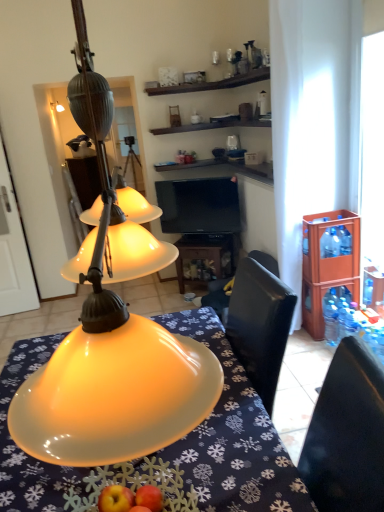
Describe the element at coordinates (233, 437) in the screenshot. The image size is (384, 512). I see `matte yellow lampshade at center` at that location.

What do you see at coordinates (112, 337) in the screenshot?
I see `matte yellow glass lampshade at center` at bounding box center [112, 337].

What do you see at coordinates (204, 258) in the screenshot?
I see `wooden table at center` at bounding box center [204, 258].

What is the approximate width of transparent plastic bottle at right, which appears as the third bottle when viewed from the top?

transparent plastic bottle at right, which appears as the third bottle when viewed from the top, is 3.31 inches in width.

What are the coordinates of `transparent plastic bottle at right, which is counted as the first bottle, starting from the bottom` in the screenshot? It's located at (331, 316).

Locate an element on the screen. black glossy tv at center is located at coordinates (199, 206).

Which object is positioned more to the left, matte yellow glass lampshade at center or matte yellow lampshade at center?

From the viewer's perspective, matte yellow glass lampshade at center appears more on the left side.

Is matte yellow glass lampshade at center in front of matte yellow lampshade at center?

Yes, the depth of matte yellow glass lampshade at center is less than that of matte yellow lampshade at center.

Are matte yellow glass lampshade at center and matte yellow lampshade at center making contact?

No, matte yellow glass lampshade at center is not beside matte yellow lampshade at center.

Based on the photo, can we say matte yellow glass lampshade at center lies outside matte yellow lampshade at center?

That's correct, matte yellow glass lampshade at center is outside of matte yellow lampshade at center.

Does point (190, 436) come behind point (208, 255)?

No, it is in front of (208, 255).

Is matte yellow lampshade at center smaller than wooden table at center?

Incorrect, matte yellow lampshade at center is not smaller in size than wooden table at center.

Does matte yellow lampshade at center have a greater width compared to wooden table at center?

Correct, the width of matte yellow lampshade at center exceeds that of wooden table at center.

Between matte yellow lampshade at center and wooden table at center, which one appears on the left side from the viewer's perspective?

matte yellow lampshade at center is more to the left.

From a real-world perspective, is blue plastic bottles at right, the 2th bottle when ordered from top to bottom, positioned under transparent plastic bottle at right, which appears as the third bottle when viewed from the top, based on gravity?

No, from a real-world perspective, blue plastic bottles at right, the 2th bottle when ordered from top to bottom, is not below transparent plastic bottle at right, which appears as the third bottle when viewed from the top.

Does blue plastic bottles at right, which is the second bottle from bottom to top, come in front of transparent plastic bottle at right, which is counted as the first bottle, starting from the bottom?

Yes, the depth of blue plastic bottles at right, which is the second bottle from bottom to top, is less than that of transparent plastic bottle at right, which is counted as the first bottle, starting from the bottom.

Does blue plastic bottles at right, which is the second bottle from bottom to top, turn towards transparent plastic bottle at right, which is counted as the first bottle, starting from the bottom?

No.

Is black glossy tv at center at the back of wooden table at center?

No.

Considering the points (183, 255) and (178, 215), which point is behind, point (183, 255) or point (178, 215)?

The point (178, 215) is more distant.

From a real-world perspective, which object rests below the other?

wooden table at center.

Locate an element on the screen. Image resolution: width=384 pixels, height=512 pixels. television above the wooden table at center (from a real-world perspective) is located at coordinates (199, 206).

Who is smaller, brown wooden cabinet at right or matte yellow glass lampshade at center?

Smaller between the two is brown wooden cabinet at right.

Considering the points (313, 220) and (103, 208), which point is in front, point (313, 220) or point (103, 208)?

Point (103, 208)

In the image, there is a matte yellow glass lampshade at center. Find the location of `bookshelf below it (from the image's perspective)`. bookshelf below it (from the image's perspective) is located at coordinates (328, 263).

Is matte yellow glass lampshade at center surrounded by brown wooden cabinet at right?

No, matte yellow glass lampshade at center is not inside brown wooden cabinet at right.

Who is shorter, transparent plastic bottle at right, which appears as the third bottle when viewed from the top, or black glossy tv at center?

transparent plastic bottle at right, which appears as the third bottle when viewed from the top.

This screenshot has width=384, height=512. I want to click on the 2nd bottle in front of the black glossy tv at center, starting your count from the anchor, so click(331, 316).

Considering the positions of objects transparent plastic bottle at right, which is counted as the first bottle, starting from the bottom, and black glossy tv at center in the image provided, who is more to the left, transparent plastic bottle at right, which is counted as the first bottle, starting from the bottom, or black glossy tv at center?

From the viewer's perspective, black glossy tv at center appears more on the left side.

Is the position of transparent plastic bottle at right, which appears as the third bottle when viewed from the top, less distant than that of brown wooden cabinet at right?

That is False.

From a real-world perspective, which object rests below the other?

transparent plastic bottle at right, which appears as the third bottle when viewed from the top.

Is brown wooden cabinet at right completely or partially inside transparent plastic bottle at right, which is counted as the first bottle, starting from the bottom?

No, brown wooden cabinet at right is not surrounded by transparent plastic bottle at right, which is counted as the first bottle, starting from the bottom.

Which object is wider, transparent plastic bottle at right, which appears as the third bottle when viewed from the top, or brown wooden cabinet at right?

brown wooden cabinet at right is wider.

The height and width of the screenshot is (512, 384). I want to click on lamp that is on the left side of matte yellow lampshade at center, so click(x=112, y=337).

This screenshot has height=512, width=384. What are the coordinates of `table below the matte yellow lampshade at center (from a real-world perspective)` in the screenshot? It's located at (204, 258).

Considering their positions, is matte yellow lampshade at center positioned further to black glossy tv at center than blue plastic bottles at right, which is the second bottle from bottom to top?

The object further to black glossy tv at center is matte yellow lampshade at center.

Considering their positions, is blue plastic bottles at right, which is the second bottle from bottom to top, positioned further to matte yellow glass lampshade at center than black glossy tv at center?

black glossy tv at center is further to matte yellow glass lampshade at center.

In the scene shown: Which object lies nearer to the anchor point clear plastic bottle at right, arranged as the 1th bottle when viewed from the top, matte yellow lampshade at center or transparent plastic bottle at right, which is counted as the first bottle, starting from the bottom?

transparent plastic bottle at right, which is counted as the first bottle, starting from the bottom.

Looking at this image, when comparing their distances from brown wooden cabinet at right, does black glossy tv at center or blue plastic bottles at right, which is the second bottle from bottom to top, seem closer?

Among the two, blue plastic bottles at right, which is the second bottle from bottom to top, is located nearer to brown wooden cabinet at right.

Considering their positions, is blue plastic bottles at right, which is the second bottle from bottom to top, positioned further to black glossy tv at center than clear plastic bottle at right, the 3th bottle positioned from the bottom?

Based on the image, blue plastic bottles at right, which is the second bottle from bottom to top, appears to be further to black glossy tv at center.

Estimate the real-world distances between objects in this image. Which object is closer to black glossy tv at center, transparent plastic bottle at right, which appears as the third bottle when viewed from the top, or wooden table at center?

wooden table at center.

When comparing their distances from transparent plastic bottle at right, which is counted as the first bottle, starting from the bottom, does matte yellow lampshade at center or matte yellow glass lampshade at center seem further?

matte yellow glass lampshade at center lies further to transparent plastic bottle at right, which is counted as the first bottle, starting from the bottom, than the other object.

Based on their spatial positions, is wooden table at center or black glossy tv at center further from matte yellow lampshade at center?

black glossy tv at center is positioned further to the anchor matte yellow lampshade at center.

At what (x,y) coordinates should I click in order to perform the action: click on television located between matte yellow lampshade at center and wooden table at center in the depth direction. Please return your answer as a coordinate pair (x, y). The image size is (384, 512). Looking at the image, I should click on (199, 206).

Find the location of a particular element. The height and width of the screenshot is (512, 384). bookshelf between matte yellow lampshade at center and transparent plastic bottle at right, which appears as the third bottle when viewed from the top, along the z-axis is located at coordinates (328, 263).

The width and height of the screenshot is (384, 512). I want to click on table between black glossy tv at center and blue plastic bottles at right, the 2th bottle when ordered from top to bottom, so click(204, 258).

This screenshot has width=384, height=512. Find the location of `bookshelf located between matte yellow lampshade at center and wooden table at center in the depth direction`. bookshelf located between matte yellow lampshade at center and wooden table at center in the depth direction is located at coordinates (328, 263).